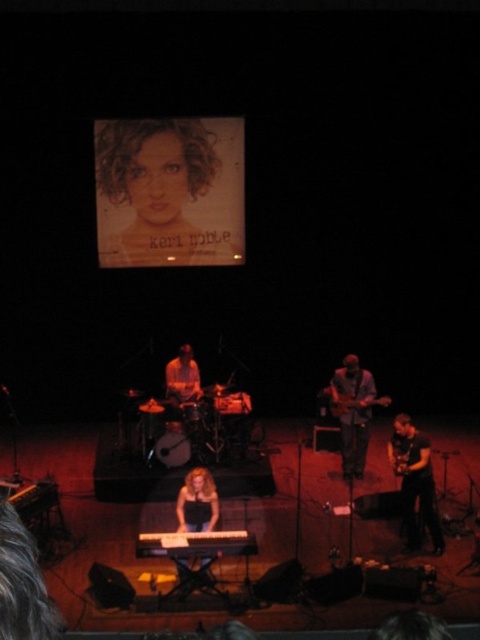
Does black matte keyboard at center have a lesser height compared to blonde hair at center?

Indeed, black matte keyboard at center has a lesser height compared to blonde hair at center.

Can you confirm if black matte keyboard at center is positioned to the left of blonde hair at center?

In fact, black matte keyboard at center is to the right of blonde hair at center.

Between point (144, 550) and point (193, 480), which one is positioned in front?

Point (144, 550) is more forward.

Find the location of a particular element. The image size is (480, 640). black matte keyboard at center is located at coordinates (195, 544).

Does curly hair at upper center come in front of glossy wood guitar at center?

That is False.

Can you confirm if curly hair at upper center is smaller than glossy wood guitar at center?

No, curly hair at upper center is not smaller than glossy wood guitar at center.

Between point (173, 182) and point (360, 403), which one is positioned behind?

Point (173, 182)

You are a GUI agent. You are given a task and a screenshot of the screen. Output one action in this format:
    pyautogui.click(x=<x>, y=<y>)
    Task: Click on the curly hair at upper center
    This screenshot has height=640, width=480.
    Given the screenshot: What is the action you would take?
    pyautogui.click(x=169, y=192)

Between curly hair at upper center and dark gray jeans at center, which one is positioned lower?

dark gray jeans at center is below.

Does curly hair at upper center appear on the right side of dark gray jeans at center?

No, curly hair at upper center is not to the right of dark gray jeans at center.

This screenshot has height=640, width=480. What do you see at coordinates (169, 192) in the screenshot?
I see `curly hair at upper center` at bounding box center [169, 192].

At what (x,y) coordinates should I click in order to perform the action: click on curly hair at upper center. Please return your answer as a coordinate pair (x, y). This screenshot has width=480, height=640. Looking at the image, I should click on (169, 192).